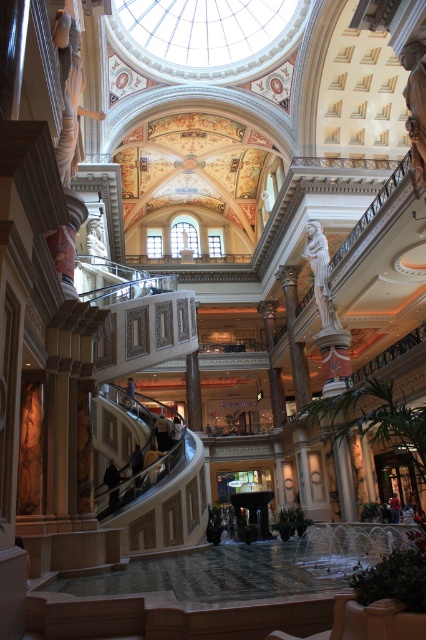
Question: Which point appears closest to the camera in this image?

Choices:
 (A) (74, 122)
 (B) (310, 220)

Answer: (A)

Question: Is white marble statue at upper left bigger than white marble statue at upper center?

Choices:
 (A) no
 (B) yes

Answer: (B)

Question: Is white marble statue at upper left closer to camera compared to polished bronze statue at upper right?

Choices:
 (A) no
 (B) yes

Answer: (B)

Question: Which of the following is the closest to the observer?

Choices:
 (A) (319, 237)
 (B) (60, 12)

Answer: (B)

Question: Can you confirm if white marble statue at upper left is thinner than polished bronze statue at upper right?

Choices:
 (A) no
 (B) yes

Answer: (A)

Question: Which is farther from the white marble statue at upper left?

Choices:
 (A) polished bronze statue at upper right
 (B) white marble statue at upper center

Answer: (B)